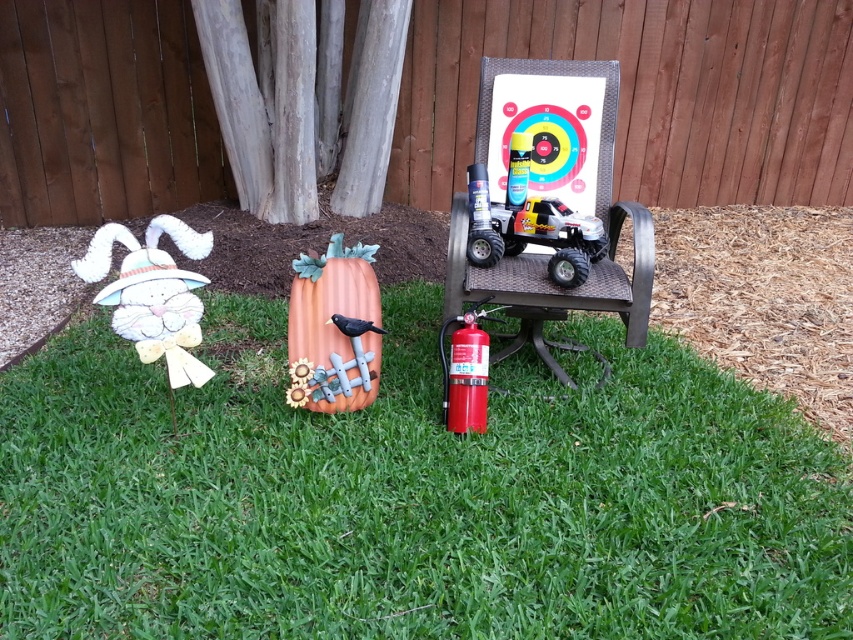
You are standing in the garden and see the white paper bunny at left and the red matte fire extinguisher at center. Which object is nearer to you?

The white paper bunny at left is closer to the viewer than the red matte fire extinguisher at center.

You are a drone operator trying to map the coordinates of objects in the scene. If the bottom left corner of the image is considered the origin point, what are the coordinates of the green grass at lower center?

The coordinates of the green grass at lower center are at point (410, 496).

You are standing in the outdoor scene and want to walk from the point at coordinates point [428,477] to the point at coordinates point [376,296]. Which direction should you face to move towards the second point?

Point [428,477] is in front of point [376,296], so you should face backwards to move towards the second point.